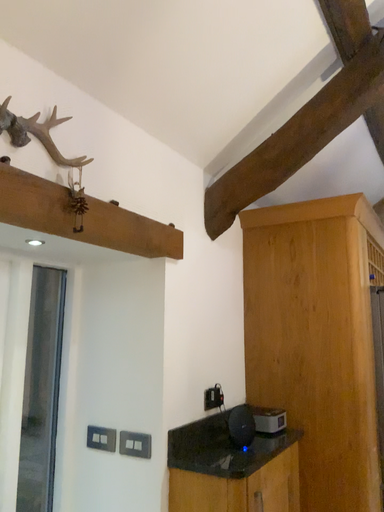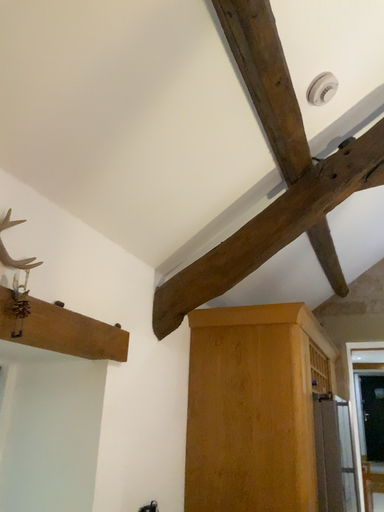
Question: Which way did the camera rotate in the video?

Choices:
 (A) rotated upward
 (B) rotated downward

Answer: (A)